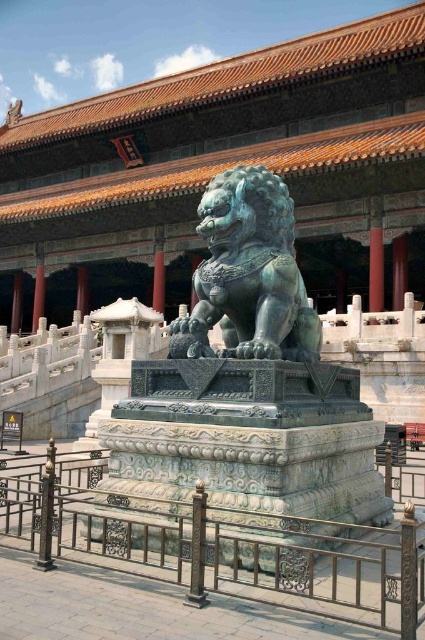
You are standing in front of the Chinese bronze lion statue and want to take a photo. You notice two points on the pedestal, point (189,524) and point (234,173). Which point will appear larger in your photo?

Point (189,524) is closer to the camera than point (234,173), so it will appear larger in the photo.

You are standing in front of the green polished stone lion at center and want to walk towards the entrance of the historical site. The entrance is located behind the metallic gold railing at lower center. Which direction should you move relative to the lion to reach the entrance?

To reach the entrance behind the metallic gold railing at lower center, you should move to the left of the green polished stone lion at center since the metallic gold railing at lower center is positioned to the left of it.